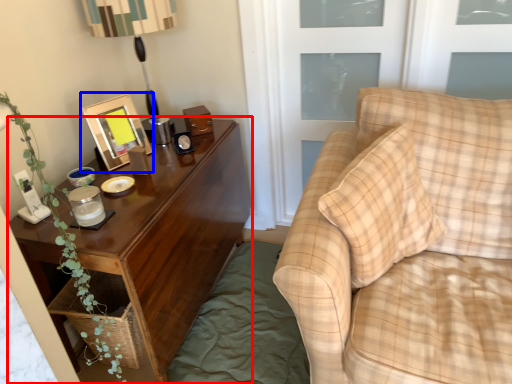
Question: Among these objects, which one is farthest to the camera, nightstand (highlighted by a red box) or picture frame (highlighted by a blue box)?

Choices:
 (A) nightstand
 (B) picture frame

Answer: (B)